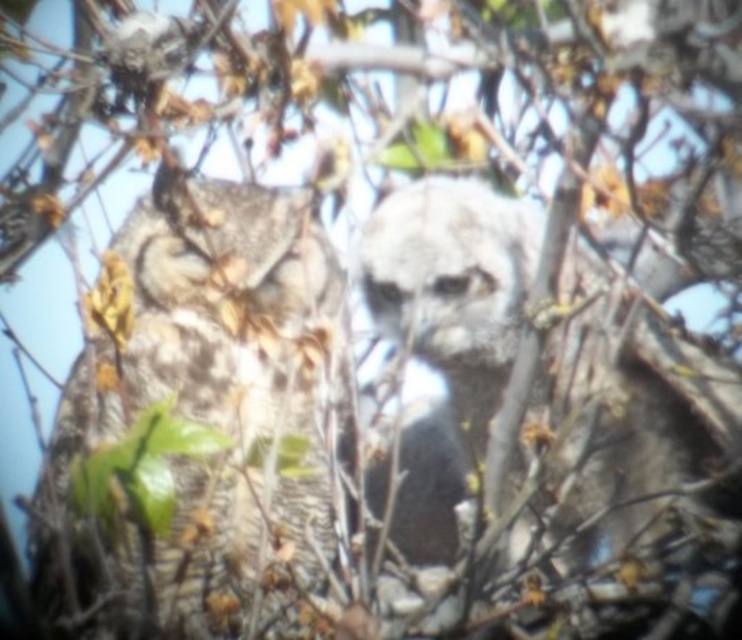
You are a birdwatcher observing two owls in a tree. You see the speckled feathered owl at center and the fuzzy white owl at center. Which owl is taller?

The speckled feathered owl at center is much taller than the fuzzy white owl at center.

You are an ornithologist observing two owls in a tree. You see the speckled feathered owl at center and the fuzzy white owl at center. Which owl is positioned to the left?

The speckled feathered owl at center is positioned to the left of the fuzzy white owl at center.

Please provide the exact coordinates of the speckled feathered owl at center in the image. The coordinate system is normalized, with the origin at the bottom left corner of the image. The x and y axes are measured in normalized units between 0 and 1. Please format your answer as a tuple of two decimal numbers rounded to three decimal places, like this example format for coordinates at the center of the image would be written as 0.5, 0.5. Please do not add any additional text or explanation in your answer.

(200, 422)